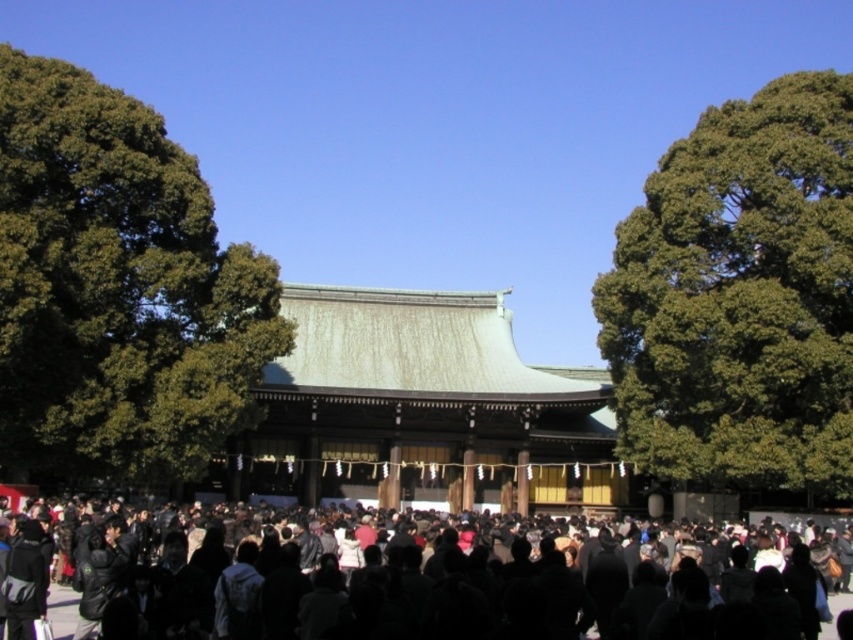
Question: Is green leafy tree at left below green leafy tree at right?

Choices:
 (A) yes
 (B) no

Answer: (B)

Question: Which of these objects is positioned closest to the black matte crowd at center?

Choices:
 (A) green leafy tree at right
 (B) green leafy tree at left

Answer: (B)

Question: Observing the image, what is the correct spatial positioning of green leafy tree at right in reference to black matte crowd at center?

Choices:
 (A) left
 (B) right

Answer: (B)

Question: Can you confirm if green leafy tree at right is positioned below black matte crowd at center?

Choices:
 (A) no
 (B) yes

Answer: (A)

Question: Which object is farther from the camera taking this photo?

Choices:
 (A) black matte crowd at center
 (B) green leafy tree at left
 (C) green leafy tree at right

Answer: (C)

Question: Which point is closer to the camera?

Choices:
 (A) green leafy tree at right
 (B) black matte crowd at center
 (C) green leafy tree at left

Answer: (B)